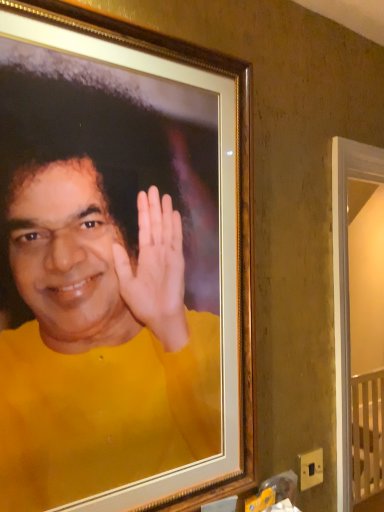
Identify the location of matte yellow shirt at center. This screenshot has width=384, height=512. (120, 263).

This screenshot has height=512, width=384. What do you see at coordinates (120, 263) in the screenshot?
I see `matte yellow shirt at center` at bounding box center [120, 263].

Locate an element on the screen. The height and width of the screenshot is (512, 384). matte yellow shirt at center is located at coordinates (120, 263).